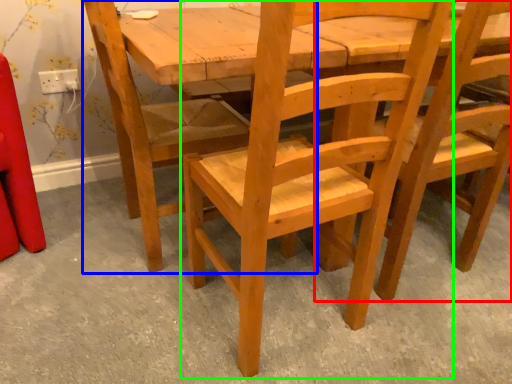
Question: Which object is positioned closest to chair (highlighted by a red box)? Select from chair (highlighted by a blue box) and chair (highlighted by a green box).

Choices:
 (A) chair
 (B) chair

Answer: (B)